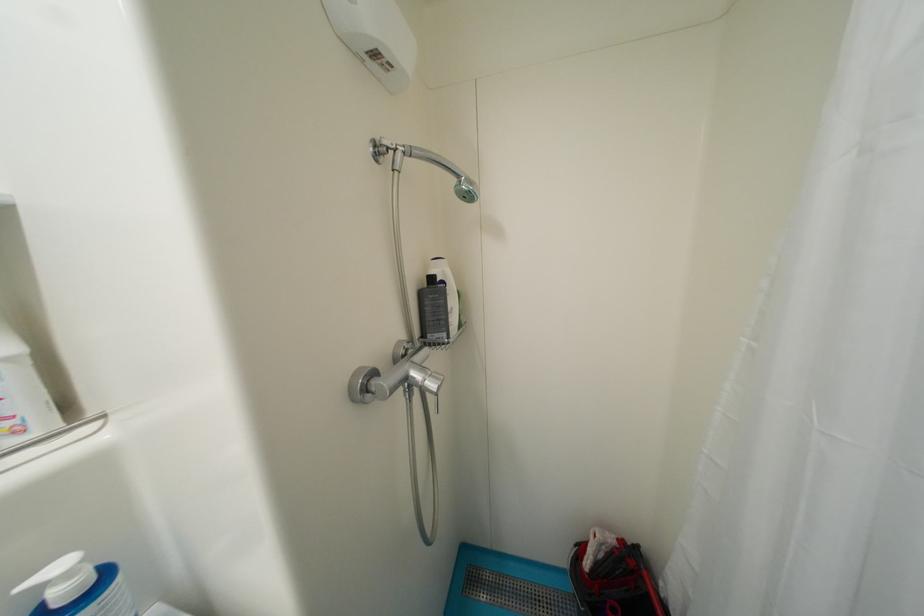
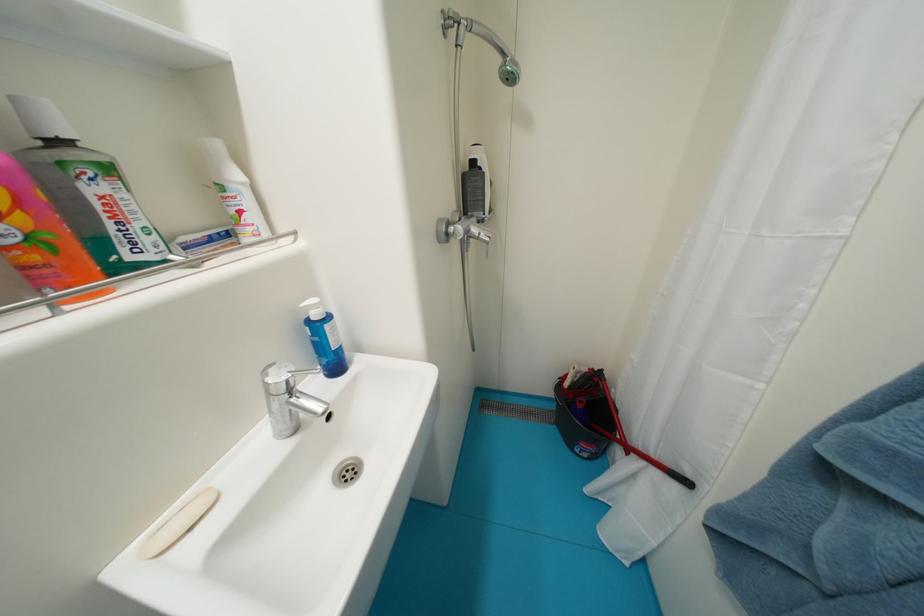
Question: The images are taken continuously from a first-person perspective. In which direction is your viewpoint rotating?

Choices:
 (A) Left
 (B) Right
 (C) Up
 (D) Down

Answer: (D)